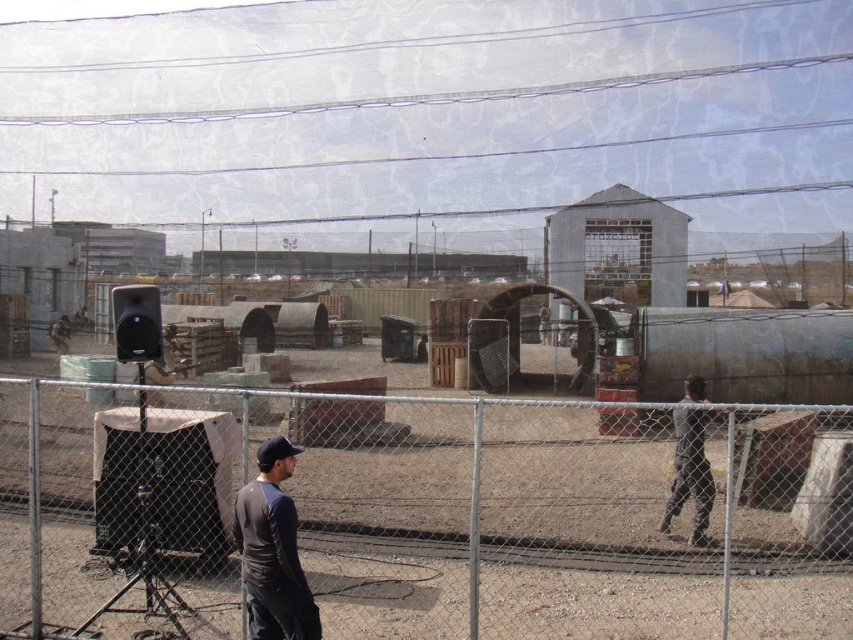
Question: Which point is farther to the camera?

Choices:
 (A) (701, 493)
 (B) (366, 451)

Answer: (B)

Question: Does metal chain-link fence at center lie behind dark gray fabric jacket at right?

Choices:
 (A) no
 (B) yes

Answer: (A)

Question: Is dark gray cotton shirt at center thinner than dark gray fabric jacket at right?

Choices:
 (A) yes
 (B) no

Answer: (B)

Question: Can you confirm if dark gray cotton shirt at center is positioned above dark gray fabric jacket at right?

Choices:
 (A) yes
 (B) no

Answer: (A)

Question: Among these points, which one is nearest to the camera?

Choices:
 (A) (456, 472)
 (B) (682, 486)

Answer: (B)

Question: Which object is closer to the camera taking this photo?

Choices:
 (A) metal chain-link fence at center
 (B) dark gray cotton shirt at center
 (C) dark gray fabric jacket at right

Answer: (B)